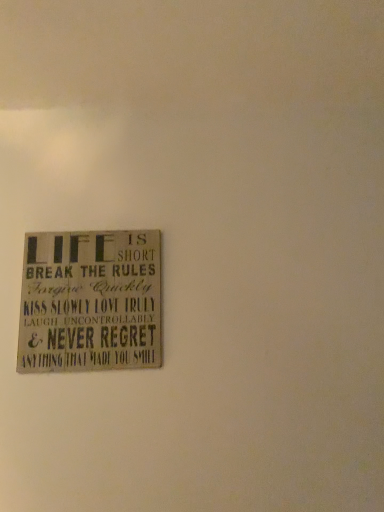
You are a GUI agent. You are given a task and a screenshot of the screen. Output one action in this format:
    pyautogui.click(x=<x>, y=<y>)
    Task: Click on the wooden signboard at center
    
    Given the screenshot: What is the action you would take?
    pyautogui.click(x=90, y=302)

What is the approximate width of wooden signboard at center?

It is 0.66 inches.

Describe the element at coordinates (90, 302) in the screenshot. The image size is (384, 512). I see `wooden signboard at center` at that location.

Identify the location of wooden signboard at center. (90, 302).